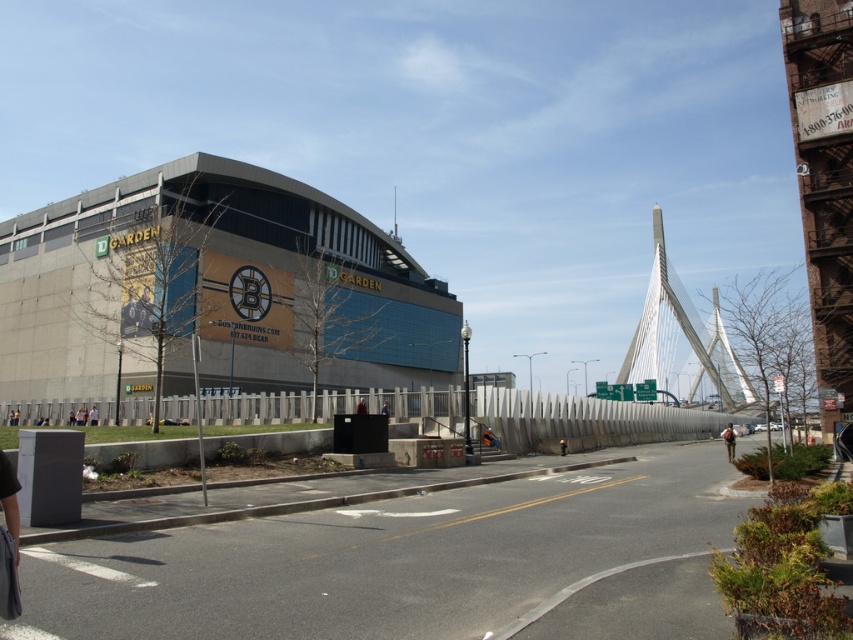
Question: Observing the image, what is the correct spatial positioning of orange fabric bag at center in reference to white cotton shirt at center?

Choices:
 (A) above
 (B) below

Answer: (A)

Question: Which of the following is the farthest from the observer?

Choices:
 (A) (363, 410)
 (B) (730, 433)
 (C) (93, 424)

Answer: (C)

Question: Which object is positioned closest to the beige concrete stadium at center left?

Choices:
 (A) dark blue suit at center
 (B) brown leather jacket at center

Answer: (B)

Question: Can you confirm if beige concrete stadium at center left is bigger than dark blue suit at center?

Choices:
 (A) no
 (B) yes

Answer: (B)

Question: Which of the following is the closest to the observer?

Choices:
 (A) (732, 458)
 (B) (386, 412)

Answer: (B)

Question: Can you confirm if brown leather jacket at center is positioned to the right of blue fabric jacket at center?

Choices:
 (A) yes
 (B) no

Answer: (A)